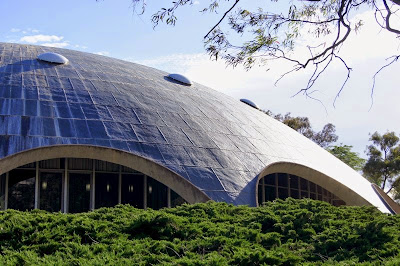
Identify the location of vent. (48, 55), (174, 80), (247, 102).